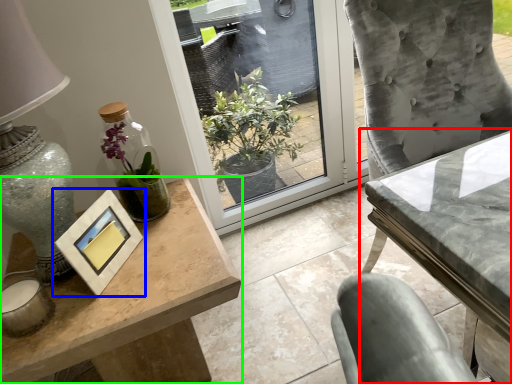
Question: Which object is positioned farthest from table (highlighted by a red box)? Select from picture frame (highlighted by a blue box) and table (highlighted by a green box).

Choices:
 (A) picture frame
 (B) table

Answer: (A)